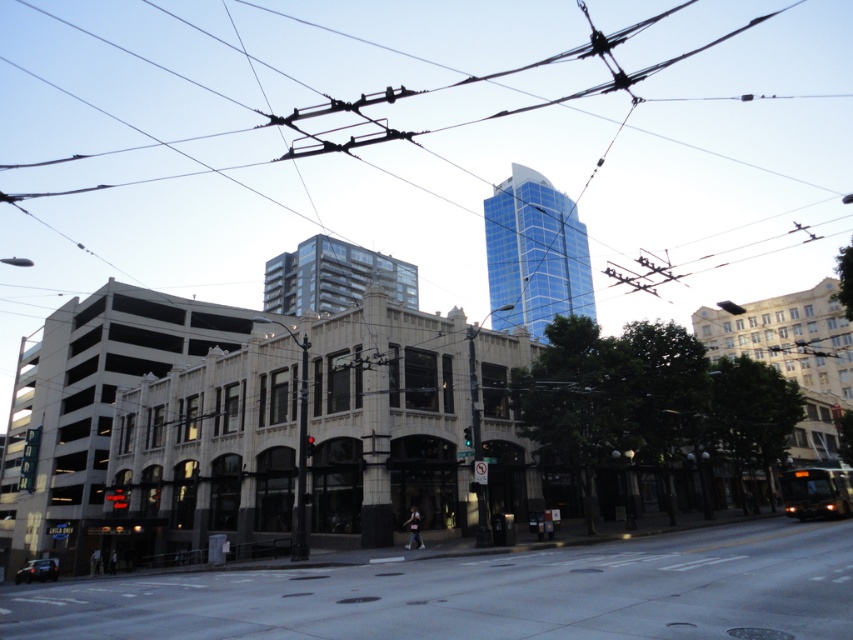
This screenshot has height=640, width=853. Identify the location of metallic wires at upper center. (730, 164).

Consider the image. Does metallic wires at upper center have a smaller size compared to glassy reflective building at center?

Incorrect, metallic wires at upper center is not smaller in size than glassy reflective building at center.

Image resolution: width=853 pixels, height=640 pixels. What do you see at coordinates (730, 164) in the screenshot? I see `metallic wires at upper center` at bounding box center [730, 164].

Locate an element on the screen. Image resolution: width=853 pixels, height=640 pixels. metallic wires at upper center is located at coordinates (730, 164).

Is concrete sidewalk at lower center below blue glassy tower at upper center?

Indeed, concrete sidewalk at lower center is positioned under blue glassy tower at upper center.

Is concrete sidewalk at lower center wider than blue glassy tower at upper center?

Indeed, concrete sidewalk at lower center has a greater width compared to blue glassy tower at upper center.

What are the coordinates of `concrete sidewalk at lower center` in the screenshot? It's located at (485, 593).

Who is more forward, (x=538, y=292) or (x=317, y=310)?

Point (x=317, y=310) is more forward.

The height and width of the screenshot is (640, 853). Describe the element at coordinates (535, 252) in the screenshot. I see `blue glassy tower at upper center` at that location.

The height and width of the screenshot is (640, 853). I want to click on blue glassy tower at upper center, so click(535, 252).